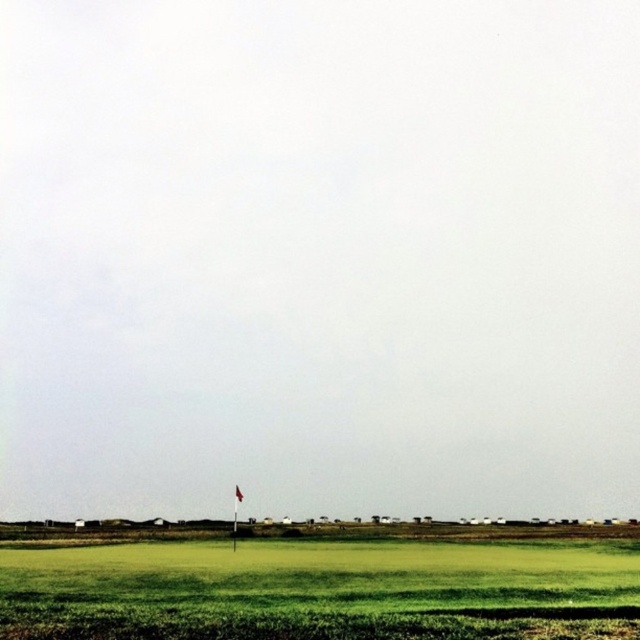
Question: Is green grassy field at lower center below red fabric flag at center?

Choices:
 (A) yes
 (B) no

Answer: (B)

Question: Which object appears farthest from the camera in this image?

Choices:
 (A) green grassy field at lower center
 (B) red fabric flag at center

Answer: (B)

Question: Is green grassy field at lower center to the right of red fabric flag at center from the viewer's perspective?

Choices:
 (A) no
 (B) yes

Answer: (B)

Question: Does green grassy field at lower center have a lesser width compared to red fabric flag at center?

Choices:
 (A) yes
 (B) no

Answer: (B)

Question: Which of the following is the closest to the observer?

Choices:
 (A) (230, 547)
 (B) (236, 497)

Answer: (A)